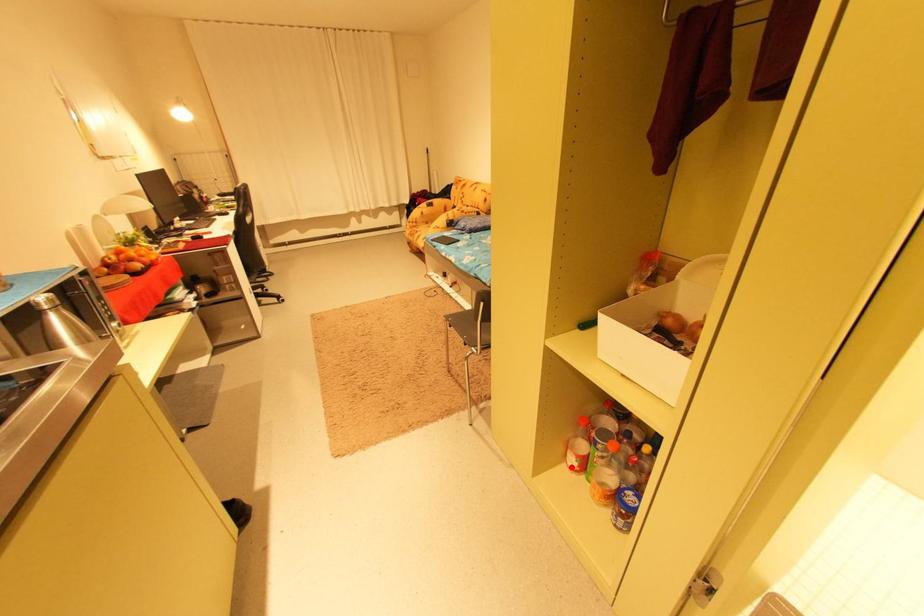
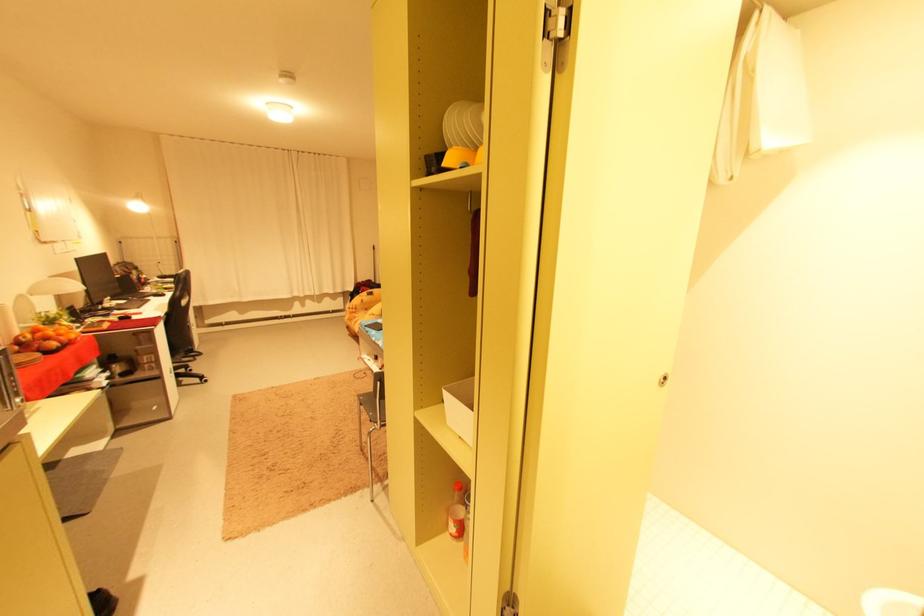
Question: I am providing you with two images of the same scene from different viewpoints. A red point is shown in image1. For the corresponding object point in image2, is it positioned nearer or farther from the camera?

Choices:
 (A) Nearer
 (B) Farther

Answer: (B)